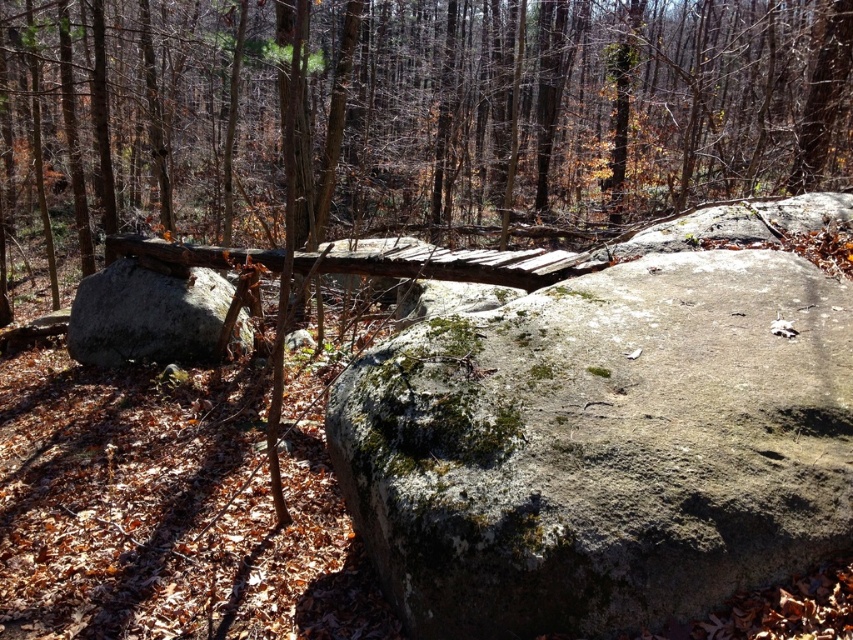
You are a hiker carrying a backpack and need to cross the gap between the two large rocks using the rustic wooden bridge. The brown rough log at center and the green mossy rock at center are both on the bridge. Which object would you step on first if you start walking from the left side of the bridge?

Since the brown rough log at center is wider than the green mossy rock at center, stepping on the brown rough log at center first would provide a more stable footing for crossing the gap.

You are a hiker carrying a backpack and need to cross the gap between the brown rough log at center and the green mossy rock at center. The log is 8.80 meters away from the rock. Can you safely jump across the gap?

The brown rough log at center is 8.80 meters away from the green mossy rock at center. Since the average human jump distance is around 2 meters, jumping 8.80 meters is not feasible. You should find another way to cross safely.

You are standing at the edge of the forest scene and see the brown rough log at center represented by point (567, 108). Can you confirm if this point accurately represents the position of the log in the image?

The brown rough log at center is indeed represented by point (567, 108), so yes, the point accurately represents the position of the log in the image.